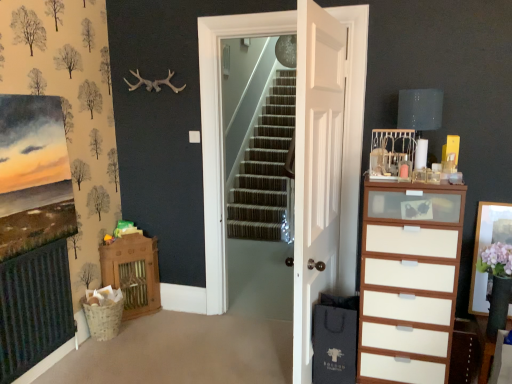
Question: Do you think white wood chest of drawers at right is within matte gray lampshade at upper right, or outside of it?

Choices:
 (A) outside
 (B) inside

Answer: (A)

Question: Considering the positions of point (403, 228) and point (441, 107), is point (403, 228) closer or farther from the camera than point (441, 107)?

Choices:
 (A) farther
 (B) closer

Answer: (B)

Question: Estimate the real-world distances between objects in this image. Which object is closer to the wooden cabinet at left?

Choices:
 (A) white wooden door at center, placed as the 1th door when sorted from front to back
 (B) white wooden door at center, positioned as the first door in back-to-front order
 (C) matte gray lampshade at upper right
 (D) wooden picture frame at right
 (E) white wood chest of drawers at right

Answer: (B)

Question: Considering the real-world distances, which object is closest to the white wood chest of drawers at right?

Choices:
 (A) matte gray lampshade at upper right
 (B) white wooden door at center, positioned as the first door in back-to-front order
 (C) wooden picture frame at right
 (D) white wooden door at center, the 2th door from the back
 (E) wooden cabinet at left

Answer: (D)